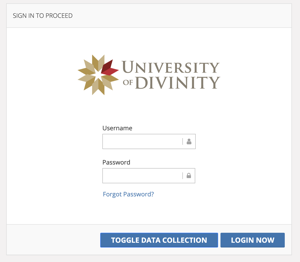
Locate an element on the screen. The width and height of the screenshot is (300, 262). white rectangular input boxes is located at coordinates (135, 142), (140, 178).